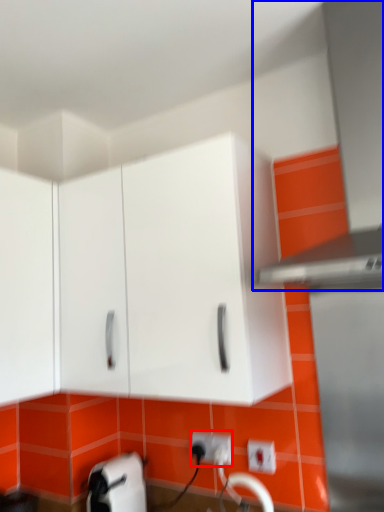
Question: Which of the following is the farthest to the observer, electric outlet (highlighted by a red box) or exhaust hood (highlighted by a blue box)?

Choices:
 (A) electric outlet
 (B) exhaust hood

Answer: (A)